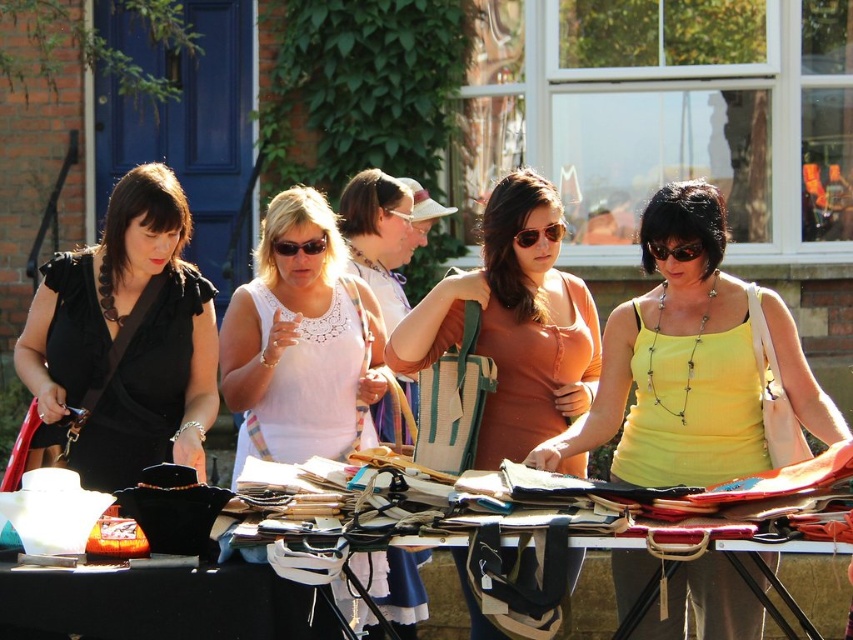
Question: Can you confirm if black fabric table at center is positioned to the left of matte brown purse at center?

Choices:
 (A) no
 (B) yes

Answer: (A)

Question: In this image, where is matte brown purse at center located relative to black plastic sunglasses at center?

Choices:
 (A) left
 (B) right

Answer: (A)

Question: Which object appears farthest from the camera in this image?

Choices:
 (A) black fabric table at center
 (B) yellow fabric tank top at center

Answer: (B)

Question: Is matte black dress at left to the right of black plastic sunglasses at center from the viewer's perspective?

Choices:
 (A) no
 (B) yes

Answer: (A)

Question: Estimate the real-world distances between objects in this image. Which object is farther from the white plastic goggles at center?

Choices:
 (A) matte orange tank top at center
 (B) matte black dress at left
 (C) matte black sunglasses at center

Answer: (B)

Question: Which object appears closest to the camera in this image?

Choices:
 (A) black plastic sunglasses at center
 (B) matte black sunglasses at center
 (C) matte black dress at left
 (D) matte brown purse at center

Answer: (A)